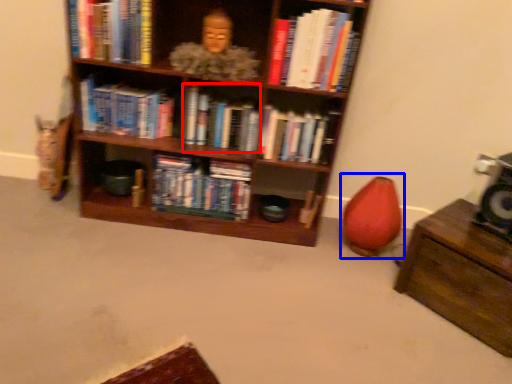
Question: Which object appears farthest to the camera in this image, book (highlighted by a red box) or bean bag chair (highlighted by a blue box)?

Choices:
 (A) book
 (B) bean bag chair

Answer: (A)